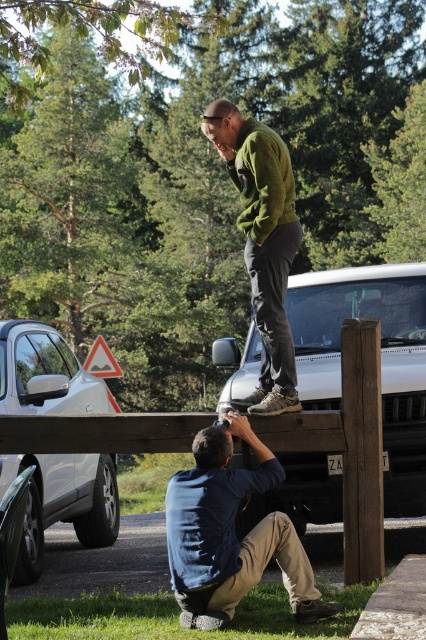
You are a photographer in the scene and want to capture both the white matte car at center and the green matte sweater at upper center in the same frame. Based on their positions, which object should you adjust your camera angle to focus on first to ensure both are visible?

The white matte car at center is below the green matte sweater at upper center, so you should adjust your camera angle to focus on the green matte sweater at upper center first to ensure both are visible.

You are a photographer trying to capture a photo of the white matte car at center and the green matte sweater at upper center. Which object should you focus on first if you want to ensure both are in focus, considering their heights?

The white matte car at center is not as tall as the green matte sweater at upper center, so you should focus on the taller object, the green matte sweater at upper center, first to ensure depth of field covers both.

You are a photographer trying to capture a photo of the silver metallic car at left while also including the blue denim shirt at lower center in the frame. Based on their distance, will you need to use a wide angle lens to fit both subjects into the shot?

The blue denim shirt at lower center and silver metallic car at left are 9.19 feet apart. To capture both subjects in the same frame, a wide angle lens would be necessary to accommodate the distance between them.